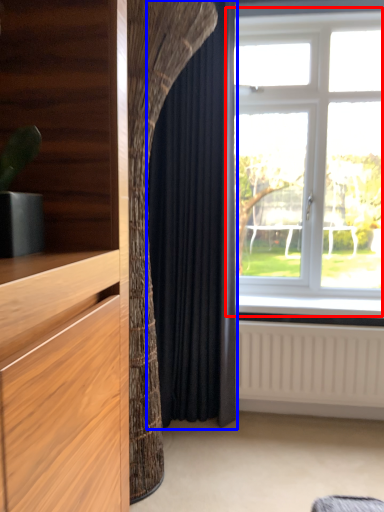
Question: Which object is further to the camera taking this photo, window (highlighted by a red box) or curtain (highlighted by a blue box)?

Choices:
 (A) window
 (B) curtain

Answer: (A)